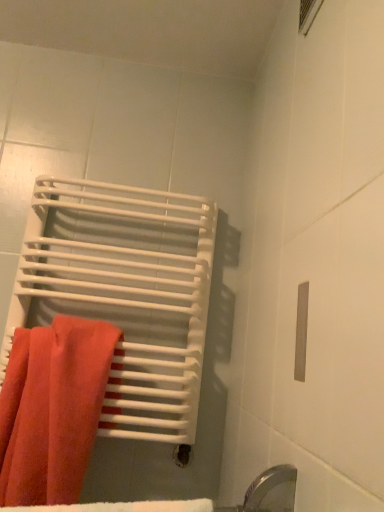
This screenshot has height=512, width=384. Find the location of `matte white towel at left`. matte white towel at left is located at coordinates (124, 293).

What is the approximate width of matte white towel at left?

16.81 centimeters.

Describe the element at coordinates (124, 293) in the screenshot. I see `matte white towel at left` at that location.

Where is `matte orange towel at left`? The image size is (384, 512). matte orange towel at left is located at coordinates (52, 409).

In order to face matte orange towel at left, should I rotate leftwards or rightwards?

Rotate your view left by about 18.688°.

Image resolution: width=384 pixels, height=512 pixels. Describe the element at coordinates (52, 409) in the screenshot. I see `matte orange towel at left` at that location.

Find the location of a particular element. This screenshot has height=512, width=384. matte white towel at left is located at coordinates (124, 293).

Would you say matte white towel at left is to the left or to the right of matte orange towel at left in the picture?

matte white towel at left is to the right of matte orange towel at left.

In the image, is matte white towel at left positioned in front of or behind matte orange towel at left?

matte white towel at left is positioned farther from the viewer than matte orange towel at left.

Between point (154, 268) and point (9, 403), which one is positioned behind?

The point (154, 268) is farther.

From the image's perspective, is matte white towel at left above or below matte orange towel at left?

Clearly, from the image's perspective, matte white towel at left is above matte orange towel at left.

From a real-world perspective, between matte white towel at left and matte orange towel at left, who is vertically lower?

matte orange towel at left.

In terms of width, does matte white towel at left look wider or thinner when compared to matte orange towel at left?

matte white towel at left is wider than matte orange towel at left.

Is matte white towel at left taller than matte orange towel at left?

Correct, matte white towel at left is much taller as matte orange towel at left.

Does matte white towel at left have a smaller size compared to matte orange towel at left?

Incorrect, matte white towel at left is not smaller in size than matte orange towel at left.

Is matte white towel at left positioned beyond the bounds of matte orange towel at left?

matte white towel at left lies outside matte orange towel at left's area.

Is there a large distance between matte white towel at left and matte orange towel at left?

No, matte white towel at left is not far from matte orange towel at left.

Does matte white towel at left turn towards matte orange towel at left?

Yes, matte white towel at left is facing matte orange towel at left.

Can you tell me how much matte white towel at left and matte orange towel at left differ in facing direction?

They differ by 1.22e-05 degrees in their facing directions.

Identify the location of towel in front of the matte white towel at left. (52, 409).

Which is more to the right, matte orange towel at left or matte white towel at left?

matte white towel at left is more to the right.

Is the depth of matte orange towel at left greater than that of matte white towel at left?

No.

Which is closer, (16,362) or (164,387)?

The point (16,362) is closer to the camera.

From the image's perspective, is matte orange towel at left located above or below matte white towel at left?

Based on their image positions, matte orange towel at left is located beneath matte white towel at left.

From a real-world perspective, is matte orange towel at left above or below matte white towel at left?

From a real-world perspective, matte orange towel at left is physically below matte white towel at left.

Which object is thinner, matte orange towel at left or matte white towel at left?

Thinner between the two is matte orange towel at left.

Can you confirm if matte orange towel at left is shorter than matte white towel at left?

Indeed, matte orange towel at left has a lesser height compared to matte white towel at left.

Considering the sizes of objects matte orange towel at left and matte white towel at left in the image provided, who is bigger, matte orange towel at left or matte white towel at left?

matte white towel at left is bigger.

Is matte white towel at left surrounded by matte orange towel at left?

No, matte white towel at left is not a part of matte orange towel at left.

Is matte orange towel at left directly adjacent to matte white towel at left?

No, matte orange towel at left is not making contact with matte white towel at left.

Is matte orange towel at left oriented towards matte white towel at left?

No, matte orange towel at left is not aimed at matte white towel at left.

Can you tell me how much matte orange towel at left and matte white towel at left differ in facing direction?

The facing directions of matte orange towel at left and matte white towel at left are 1.22e-05 degrees apart.

You are a GUI agent. You are given a task and a screenshot of the screen. Output one action in this format:
    pyautogui.click(x=<x>, y=<y>)
    Task: Click on the towel that appears in front of the matte white towel at left
    The image size is (384, 512).
    Given the screenshot: What is the action you would take?
    pyautogui.click(x=52, y=409)

Where is `bath towel above the matte orange towel at left (from the image's perspective)`? bath towel above the matte orange towel at left (from the image's perspective) is located at coordinates click(x=124, y=293).

Image resolution: width=384 pixels, height=512 pixels. Find the location of `bath towel above the matte orange towel at left (from a real-world perspective)`. bath towel above the matte orange towel at left (from a real-world perspective) is located at coordinates (124, 293).